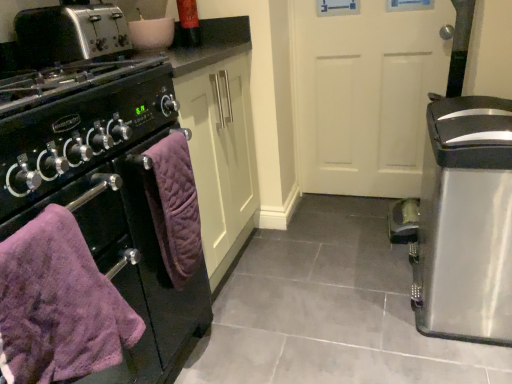
Question: Considering the relative sizes of silver metallic toaster at upper left and purple quilted towel at lower left, which appears as the 2th bath towel when viewed from the front, in the image provided, is silver metallic toaster at upper left wider than purple quilted towel at lower left, which appears as the 2th bath towel when viewed from the front,?

Choices:
 (A) yes
 (B) no

Answer: (A)

Question: Considering the relative sizes of silver metallic toaster at upper left and purple quilted towel at lower left, the 1th bath towel when ordered from back to front, in the image provided, is silver metallic toaster at upper left smaller than purple quilted towel at lower left, the 1th bath towel when ordered from back to front,?

Choices:
 (A) yes
 (B) no

Answer: (B)

Question: Is silver metallic toaster at upper left shorter than purple quilted towel at lower left, the 1th bath towel when ordered from back to front?

Choices:
 (A) yes
 (B) no

Answer: (A)

Question: Is silver metallic toaster at upper left taller than purple quilted towel at lower left, the 1th bath towel when ordered from back to front?

Choices:
 (A) yes
 (B) no

Answer: (B)

Question: Does silver metallic toaster at upper left appear on the left side of purple quilted towel at lower left, the 1th bath towel when ordered from back to front?

Choices:
 (A) yes
 (B) no

Answer: (A)

Question: Is silver metallic toaster at upper left positioned far away from purple quilted towel at lower left, which appears as the 2th bath towel when viewed from the front?

Choices:
 (A) yes
 (B) no

Answer: (B)

Question: Considering the relative sizes of matte black oven at left and satin silver trash can at right in the image provided, is matte black oven at left thinner than satin silver trash can at right?

Choices:
 (A) no
 (B) yes

Answer: (A)

Question: Is matte black oven at left behind satin silver trash can at right?

Choices:
 (A) no
 (B) yes

Answer: (A)

Question: Is matte black oven at left facing away from satin silver trash can at right?

Choices:
 (A) no
 (B) yes

Answer: (A)

Question: From the image's perspective, does matte black oven at left appear lower than satin silver trash can at right?

Choices:
 (A) yes
 (B) no

Answer: (A)

Question: Does matte black oven at left turn towards satin silver trash can at right?

Choices:
 (A) yes
 (B) no

Answer: (B)

Question: From a real-world perspective, is matte black oven at left located beneath satin silver trash can at right?

Choices:
 (A) no
 (B) yes

Answer: (A)

Question: Does purple quilted towel at lower left, which appears as the 2th bath towel when viewed from the front, appear on the right side of purple quilted towel at left, arranged as the second bath towel when viewed from the back?

Choices:
 (A) yes
 (B) no

Answer: (A)